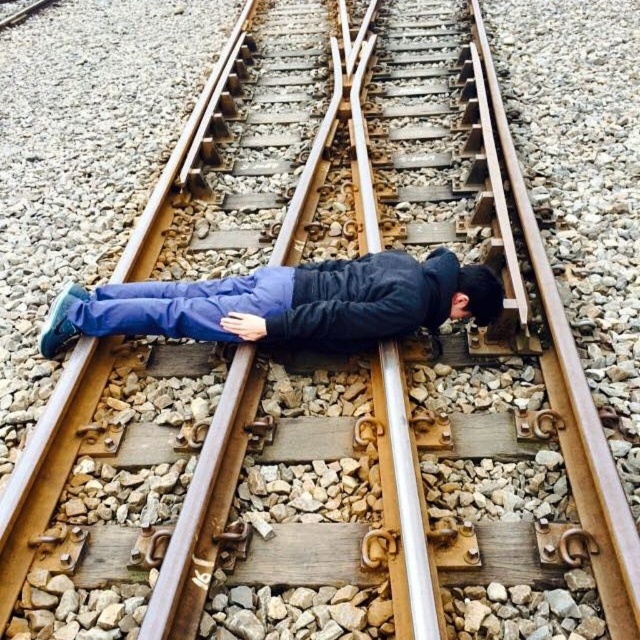
Question: Which point is closer to the camera?

Choices:
 (A) black matte hair at center
 (B) blue fabric pants at center

Answer: (B)

Question: Is blue fabric pants at center to the left of black matte hair at center from the viewer's perspective?

Choices:
 (A) no
 (B) yes

Answer: (B)

Question: Can you confirm if blue fabric pants at center is thinner than black matte hair at center?

Choices:
 (A) no
 (B) yes

Answer: (A)

Question: Does blue fabric pants at center have a lesser width compared to black matte hair at center?

Choices:
 (A) yes
 (B) no

Answer: (B)

Question: Which object appears farthest from the camera in this image?

Choices:
 (A) black matte hair at center
 (B) blue fabric pants at center

Answer: (A)